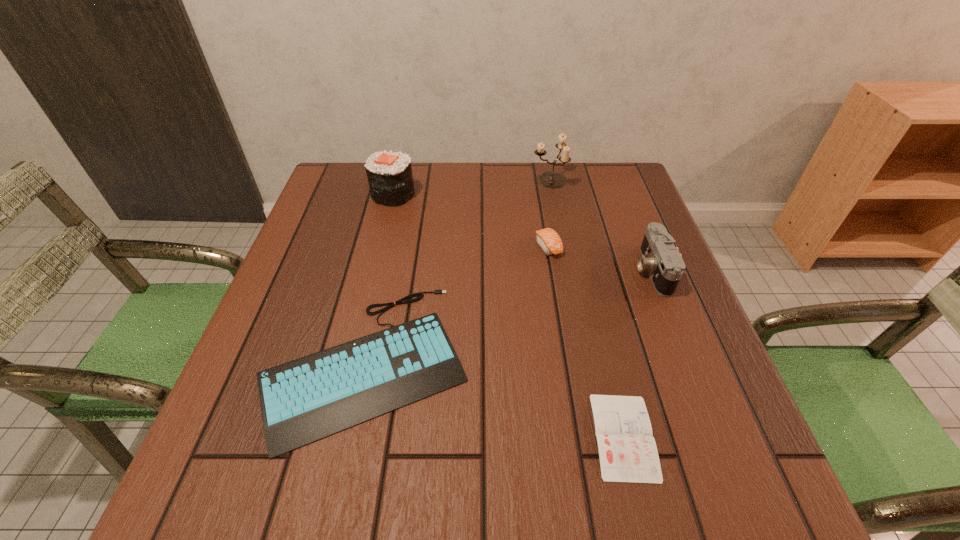
This screenshot has width=960, height=540. What are the coordinates of `vacant region at the left edge of the desktop` in the screenshot? It's located at (305, 234).

This screenshot has width=960, height=540. I want to click on free location at the right edge of the desktop, so click(x=696, y=355).

This screenshot has width=960, height=540. What are the coordinates of `vacant space at the far left corner` in the screenshot? It's located at (350, 173).

In the image, there is a desktop. In order to click on free space at the near left corner in this screenshot , I will do tap(215, 478).

This screenshot has width=960, height=540. Identify the location of vacant space at the far right corner. (630, 171).

The width and height of the screenshot is (960, 540). In order to click on unoccupied area between the rightmost object and the computer keyboard in this screenshot , I will do `click(510, 316)`.

Find the location of a particular element. The image size is (960, 540). free point between the diary and the farther sushi is located at coordinates (509, 315).

At what (x,y) coordinates should I click in order to perform the action: click on free space between the computer keyboard and the taller sushi. Please return your answer as a coordinate pair (x, y). Looking at the image, I should click on (380, 278).

You are a GUI agent. You are given a task and a screenshot of the screen. Output one action in this format:
    pyautogui.click(x=<x>, y=<y>)
    Task: Click on the free spot between the shortest object and the computer keyboard
    This screenshot has height=540, width=960.
    Given the screenshot: What is the action you would take?
    pyautogui.click(x=495, y=399)

Find the location of `free space between the left sushi and the candle holder`. free space between the left sushi and the candle holder is located at coordinates (471, 187).